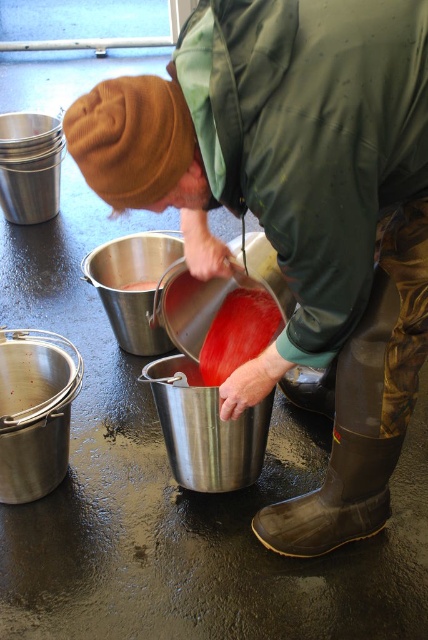
Is metallic bucket at center below black rubber boot at lower right?

Actually, metallic bucket at center is above black rubber boot at lower right.

Which is below, metallic bucket at center or black rubber boot at lower right?

black rubber boot at lower right is lower down.

Does point (372, 310) lie behind point (389, 508)?

No, (372, 310) is closer to viewer.

Locate an element on the screen. Image resolution: width=428 pixels, height=640 pixels. metallic bucket at center is located at coordinates (296, 209).

Is black rubber boot at lower right bigger than matte red liquid at center?

Yes.

Can you confirm if black rubber boot at lower right is shorter than matte red liquid at center?

A: Incorrect, black rubber boot at lower right's height does not fall short of matte red liquid at center's.

Locate an element on the screen. The width and height of the screenshot is (428, 640). black rubber boot at lower right is located at coordinates (335, 497).

Where is `black rubber boot at lower right`? The image size is (428, 640). black rubber boot at lower right is located at coordinates (335, 497).

Between bright red smooth liquid at center and matte red liquid at center, which one is positioned higher?

matte red liquid at center

Does bright red smooth liquid at center have a larger size compared to matte red liquid at center?

Correct, bright red smooth liquid at center is larger in size than matte red liquid at center.

Find the location of a particular element. bright red smooth liquid at center is located at coordinates (237, 333).